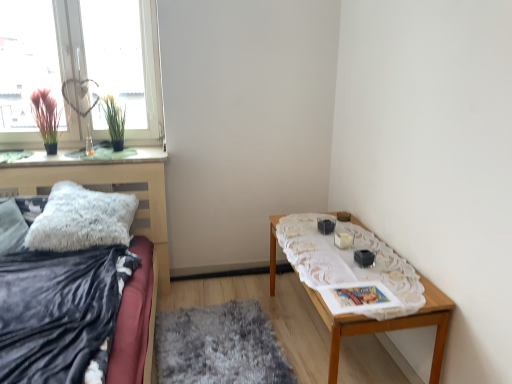
Question: Considering the relative sizes of silky pink plant at window, which is the 2th plant in right-to-left order, and green grass-like plant at upper left, the 2th plant when ordered from left to right, in the image provided, is silky pink plant at window, which is the 2th plant in right-to-left order, smaller than green grass-like plant at upper left, the 2th plant when ordered from left to right,?

Choices:
 (A) no
 (B) yes

Answer: (A)

Question: Does silky pink plant at window, arranged as the first plant when viewed from the left, lie behind green grass-like plant at upper left, the 2th plant when ordered from left to right?

Choices:
 (A) yes
 (B) no

Answer: (B)

Question: Considering the relative sizes of silky pink plant at window, arranged as the first plant when viewed from the left, and green grass-like plant at upper left, positioned as the 1th plant in right-to-left order, in the image provided, is silky pink plant at window, arranged as the first plant when viewed from the left, thinner than green grass-like plant at upper left, positioned as the 1th plant in right-to-left order,?

Choices:
 (A) no
 (B) yes

Answer: (A)

Question: Is silky pink plant at window, arranged as the first plant when viewed from the left, taller than green grass-like plant at upper left, the 2th plant when ordered from left to right?

Choices:
 (A) no
 (B) yes

Answer: (B)

Question: Are silky pink plant at window, arranged as the first plant when viewed from the left, and green grass-like plant at upper left, the 2th plant when ordered from left to right, beside each other?

Choices:
 (A) no
 (B) yes

Answer: (A)

Question: From a real-world perspective, relative to wooden table at right, is white lace tablecloth at right, the 1th blanket positioned from the right, vertically above or below?

Choices:
 (A) below
 (B) above

Answer: (B)

Question: Is white lace tablecloth at right, the 1th blanket positioned from the right, spatially inside wooden table at right, or outside of it?

Choices:
 (A) outside
 (B) inside

Answer: (B)

Question: Does point (414, 281) appear closer or farther from the camera than point (422, 279)?

Choices:
 (A) closer
 (B) farther

Answer: (B)

Question: In terms of height, does white lace tablecloth at right, the 2th blanket when ordered from left to right, look taller or shorter compared to wooden table at right?

Choices:
 (A) short
 (B) tall

Answer: (A)

Question: Considering the positions of fuzzy gray rug at center and transparent glass window at upper left in the image, is fuzzy gray rug at center taller or shorter than transparent glass window at upper left?

Choices:
 (A) tall
 (B) short

Answer: (B)

Question: Relative to transparent glass window at upper left, is fuzzy gray rug at center in front or behind?

Choices:
 (A) front
 (B) behind

Answer: (A)

Question: Is fuzzy gray rug at center bigger or smaller than transparent glass window at upper left?

Choices:
 (A) big
 (B) small

Answer: (B)

Question: Which is correct: fuzzy gray rug at center is inside transparent glass window at upper left, or outside of it?

Choices:
 (A) outside
 (B) inside

Answer: (A)

Question: Is wooden table at right in front of or behind green grass-like plant at upper left, the 2th plant when ordered from left to right, in the image?

Choices:
 (A) front
 (B) behind

Answer: (A)

Question: Choose the correct answer: Is wooden table at right inside green grass-like plant at upper left, the 2th plant when ordered from left to right, or outside it?

Choices:
 (A) inside
 (B) outside

Answer: (B)